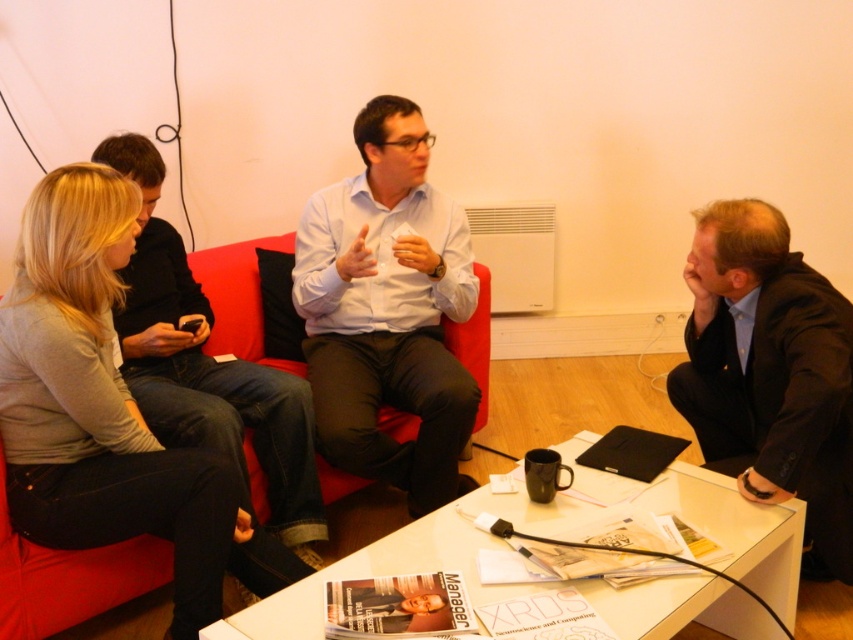
Question: Based on their relative distances, which object is farther from the light gray sweater at left?

Choices:
 (A) light blue shirt at center
 (B) dark blue suit at right

Answer: (B)

Question: Which of the following is the closest to the observer?

Choices:
 (A) dark blue suit at right
 (B) light blue shirt at center

Answer: (A)

Question: Which point is farther from the camera taking this photo?

Choices:
 (A) (404, 387)
 (B) (144, 452)
 (C) (692, 324)

Answer: (A)

Question: Does light gray sweater at left appear on the left side of light blue shirt at center?

Choices:
 (A) yes
 (B) no

Answer: (A)

Question: Is light gray sweater at left to the right of light blue shirt at center from the viewer's perspective?

Choices:
 (A) no
 (B) yes

Answer: (A)

Question: Does light gray sweater at left have a smaller size compared to light blue shirt at center?

Choices:
 (A) yes
 (B) no

Answer: (A)